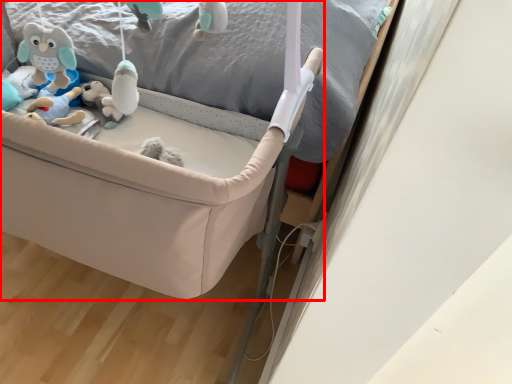
Question: Considering the relative positions of infant bed (annotated by the red box) and bed frame in the image provided, where is infant bed (annotated by the red box) located with respect to the staircase?

Choices:
 (A) left
 (B) right

Answer: (A)